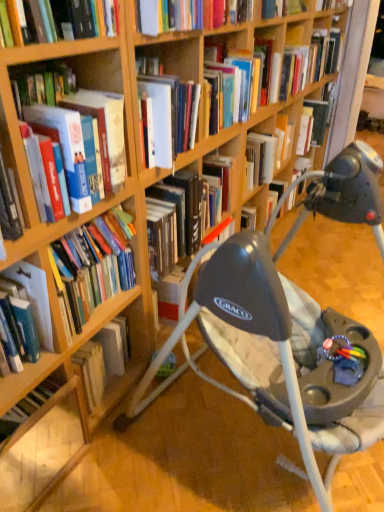
This screenshot has height=512, width=384. What do you see at coordinates (35, 297) in the screenshot?
I see `hardcover book at lower left, positioned as the first book in left-to-right order` at bounding box center [35, 297].

This screenshot has height=512, width=384. What are the coordinates of `hardcover book at upper right, the 5th book in the front-to-back sequence` in the screenshot? It's located at (326, 51).

In order to face hardcover book at upper right, the first book in the right-to-left sequence, should I rotate leftwards or rightwards?

To face it directly, rotate right by 17.690 degrees.

What do you see at coordinates (92, 267) in the screenshot? I see `hardcover book at left, positioned as the 2th book in left-to-right order` at bounding box center [92, 267].

Describe the element at coordinates (321, 112) in the screenshot. I see `hardcover book at upper right, the 2th book viewed from the right` at that location.

The width and height of the screenshot is (384, 512). In order to click on hardcover book at lower left, the 4th book in the back-to-front sequence in this screenshot , I will do `click(35, 297)`.

Which is further, (64,310) or (325,481)?

Positioned behind is point (325,481).

Is matte black baby swing at center at the back of hardcover book at left, the third book from the back?

No, hardcover book at left, the third book from the back, is not facing away from matte black baby swing at center.

Is hardcover book at left, positioned as the 2th book in left-to-right order, in front of or behind matte black baby swing at center in the image?

Answer: hardcover book at left, positioned as the 2th book in left-to-right order, is behind matte black baby swing at center.

Looking at this image, relative to hardcover book at left, the third book positioned from the front, is hardcover book at upper right, the 2th book viewed from the right, in front or behind?

hardcover book at upper right, the 2th book viewed from the right, is behind hardcover book at left, the third book positioned from the front.

Is hardcover book at upper right, acting as the second book starting from the back, inside the boundaries of hardcover book at left, positioned as the 2th book in left-to-right order, or outside?

hardcover book at upper right, acting as the second book starting from the back, lies outside hardcover book at left, positioned as the 2th book in left-to-right order.

Are hardcover book at upper right, acting as the second book starting from the back, and hardcover book at left, which ranks as the fourth book in top-to-bottom order, far apart?

Yes, hardcover book at upper right, acting as the second book starting from the back, is far from hardcover book at left, which ranks as the fourth book in top-to-bottom order.

Which is closer, (326,123) or (99,233)?

The point (99,233) is in front.

Which is more to the left, hardcover book at upper right, the 5th book in the front-to-back sequence, or hardcover book at upper right, the fourth book from the left?

From the viewer's perspective, hardcover book at upper right, the fourth book from the left, appears more on the left side.

Could you tell me if hardcover book at upper right, marked as the 1th book in a back-to-front arrangement, is turned towards hardcover book at upper right, arranged as the fourth book when viewed from the front?

No, hardcover book at upper right, marked as the 1th book in a back-to-front arrangement, is not facing towards hardcover book at upper right, arranged as the fourth book when viewed from the front.

Would you say hardcover book at upper right, the fourth book from the left, is part of hardcover book at upper right, the 5th book in the front-to-back sequence,'s contents?

No, hardcover book at upper right, the 5th book in the front-to-back sequence, does not contain hardcover book at upper right, the fourth book from the left.

From a real-world perspective, is hardcover book at upper right, arranged as the second book when viewed from the top, above or below matte black baby swing at center?

Clearly, from a real-world perspective, hardcover book at upper right, arranged as the second book when viewed from the top, is above matte black baby swing at center.

In the scene shown: Can you confirm if hardcover book at upper right, the fourth book from the left, is thinner than matte black baby swing at center?

Correct, the width of hardcover book at upper right, the fourth book from the left, is less than that of matte black baby swing at center.

Which book is the 1st one when counting from the right side of the matte black baby swing at center? Please provide its 2D coordinates.

[(321, 112)]

Which object is positioned more to the right, hardcover book at upper right, the fourth book from the left, or matte black baby swing at center?

hardcover book at upper right, the fourth book from the left, is more to the right.

Consider the image. Which of these two, matte black baby swing at center or hardcover book at lower left, the 4th book in the back-to-front sequence, is wider?

With larger width is matte black baby swing at center.

Is matte black baby swing at center aimed at hardcover book at lower left, which is the 5th book in right-to-left order?

No, matte black baby swing at center is not turned towards hardcover book at lower left, which is the 5th book in right-to-left order.

Considering the positions of point (310, 425) and point (41, 293), is point (310, 425) closer or farther from the camera than point (41, 293)?

Point (310, 425).

Could you measure the distance between matte black baby swing at center and hardcover book at left, which is the 5th book in back-to-front order?

The distance of matte black baby swing at center from hardcover book at left, which is the 5th book in back-to-front order, is 23.27 inches.

From a real-world perspective, which object stands above the other?

In real-world perspective, hardcover book at left, which is counted as the first book, starting from the front, is above.

Is matte black baby swing at center far from hardcover book at left, arranged as the third book when viewed from the right?

matte black baby swing at center is actually quite close to hardcover book at left, arranged as the third book when viewed from the right.

This screenshot has height=512, width=384. I want to click on chair in front of the hardcover book at left, which appears as the 3th book when viewed from the top, so click(286, 328).

Identify the location of the 2nd book counting from the right of the matte black baby swing at center. The height and width of the screenshot is (512, 384). (326, 51).

Is hardcover book at upper right, marked as the 1th book in a back-to-front arrangement, wider or thinner than matte black baby swing at center?

Considering their sizes, hardcover book at upper right, marked as the 1th book in a back-to-front arrangement, looks slimmer than matte black baby swing at center.

Who is smaller, hardcover book at upper right, the 5th book in the front-to-back sequence, or matte black baby swing at center?

hardcover book at upper right, the 5th book in the front-to-back sequence.

From the image's perspective, which is above, hardcover book at upper right, the first book in the right-to-left sequence, or matte black baby swing at center?

From the image's view, hardcover book at upper right, the first book in the right-to-left sequence, is above.

Where is `chair in front of the hardcover book at left, the 4th book viewed from the right`? chair in front of the hardcover book at left, the 4th book viewed from the right is located at coordinates (286, 328).

There is a hardcover book at upper right, which is the fourth book in bottom-to-top order. Find the location of `the 1st book above it (from a real-world perspective)`. the 1st book above it (from a real-world perspective) is located at coordinates (92, 267).

Which object lies further to the anchor point hardcover book at left, which appears as the 3th book when viewed from the top, matte black baby swing at center or hardcover book at lower left, the 4th book in the back-to-front sequence?

matte black baby swing at center lies further to hardcover book at left, which appears as the 3th book when viewed from the top, than the other object.

When comparing their distances from hardcover book at left, the 3th book when ordered from left to right, does hardcover book at lower left, positioned as the first book in left-to-right order, or hardcover book at upper right, the first book in the right-to-left sequence, seem further?

The object further to hardcover book at left, the 3th book when ordered from left to right, is hardcover book at upper right, the first book in the right-to-left sequence.

When comparing their distances from hardcover book at upper right, marked as the 1th book in a back-to-front arrangement, does hardcover book at left, the 3th book when ordered from left to right, or hardcover book at lower left, positioned as the first book in left-to-right order, seem closer?

Based on the image, hardcover book at left, the 3th book when ordered from left to right, appears to be nearer to hardcover book at upper right, marked as the 1th book in a back-to-front arrangement.

In the scene shown: When comparing their distances from hardcover book at left, which ranks as the fourth book in top-to-bottom order, does matte black baby swing at center or hardcover book at left, which is counted as the first book, starting from the front, seem further?

The object further to hardcover book at left, which ranks as the fourth book in top-to-bottom order, is matte black baby swing at center.

Looking at the image, which one is located closer to hardcover book at upper right, the 5th book in the front-to-back sequence, matte black baby swing at center or hardcover book at lower left, the 4th book in the back-to-front sequence?

matte black baby swing at center lies closer to hardcover book at upper right, the 5th book in the front-to-back sequence, than the other object.

Based on the photo, based on their spatial positions, is hardcover book at upper right, the first book in the right-to-left sequence, or hardcover book at left, positioned as the 2th book in left-to-right order, further from hardcover book at upper right, the fourth book from the left?

hardcover book at left, positioned as the 2th book in left-to-right order, lies further to hardcover book at upper right, the fourth book from the left, than the other object.

Which object lies nearer to the anchor point hardcover book at upper right, the 5th book in the front-to-back sequence, hardcover book at left, the third book positioned from the front, or hardcover book at left, the 3th book when ordered from left to right?

The object closer to hardcover book at upper right, the 5th book in the front-to-back sequence, is hardcover book at left, the 3th book when ordered from left to right.

Based on their spatial positions, is hardcover book at upper right, which is the fourth book in bottom-to-top order, or matte black baby swing at center further from hardcover book at lower left, the 4th book in the back-to-front sequence?

The object further to hardcover book at lower left, the 4th book in the back-to-front sequence, is hardcover book at upper right, which is the fourth book in bottom-to-top order.

This screenshot has width=384, height=512. Identify the location of book between hardcover book at lower left, which is counted as the fifth book, starting from the top, and hardcover book at upper right, arranged as the second book when viewed from the top, from front to back. (92, 267).

Identify the location of book located between hardcover book at left, positioned as the 2th book in left-to-right order, and hardcover book at upper right, the fifth book from the bottom, in the depth direction. (321, 112).

Image resolution: width=384 pixels, height=512 pixels. What are the coordinates of `book between hardcover book at left, the third book positioned from the front, and matte black baby swing at center from left to right` in the screenshot? It's located at (83, 133).

Where is `book between hardcover book at left, which is counted as the first book, starting from the front, and hardcover book at lower left, the 4th book in the back-to-front sequence, from top to bottom`? book between hardcover book at left, which is counted as the first book, starting from the front, and hardcover book at lower left, the 4th book in the back-to-front sequence, from top to bottom is located at coordinates (92, 267).